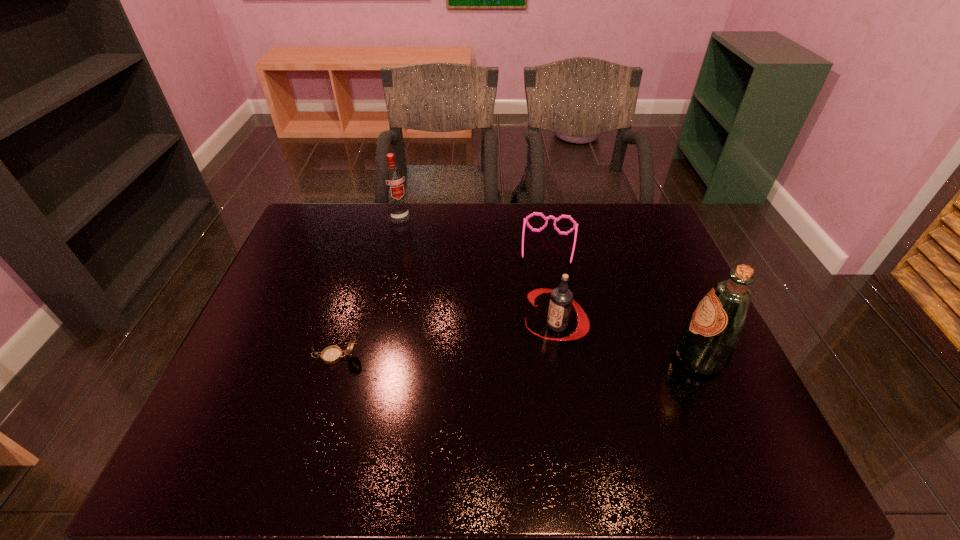
I want to click on spectacles situated at the far edge, so pyautogui.click(x=575, y=227).

Locate an element on the screen. Image resolution: width=960 pixels, height=540 pixels. vodka that is at the far edge is located at coordinates (393, 178).

Where is `object that is at the right edge`? This screenshot has height=540, width=960. object that is at the right edge is located at coordinates (706, 344).

Identify the location of vacant area at the far edge. (497, 238).

Find the location of a particular element. Image resolution: width=960 pixels, height=540 pixels. vacant point at the near edge is located at coordinates (324, 395).

Locate an element on the screen. blank space at the left edge of the desktop is located at coordinates (325, 255).

Find the location of a particular element. The image size is (960, 540). free space at the right edge of the desktop is located at coordinates (643, 298).

Where is `vacant space at the far left corner of the desktop`? This screenshot has width=960, height=540. vacant space at the far left corner of the desktop is located at coordinates (309, 241).

The image size is (960, 540). Identify the location of free space at the far right corner of the desktop. (648, 231).

At what (x,y) coordinates should I click in order to perform the action: click on unoccupied position between the compass and the rightmost object. Please return your answer as a coordinate pair (x, y). Looking at the image, I should click on (517, 357).